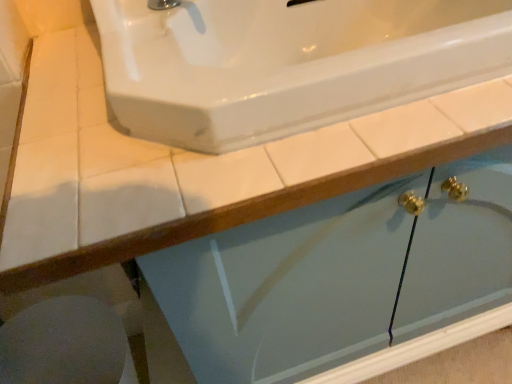
The image size is (512, 384). What do you see at coordinates (288, 63) in the screenshot?
I see `white glossy sink at upper center` at bounding box center [288, 63].

The image size is (512, 384). Find the location of `white glossy sink at upper center`. white glossy sink at upper center is located at coordinates coord(288,63).

The image size is (512, 384). In order to click on white glossy porcelain at lower left in this screenshot , I will do `click(66, 344)`.

What do you see at coordinates (66, 344) in the screenshot?
I see `white glossy porcelain at lower left` at bounding box center [66, 344].

At what (x,y) coordinates should I click in order to perform the action: click on white glossy sink at upper center. Please return your answer as a coordinate pair (x, y). Looking at the image, I should click on (288, 63).

Considering the positions of objects white glossy porcelain at lower left and white glossy sink at upper center in the image provided, who is more to the left, white glossy porcelain at lower left or white glossy sink at upper center?

white glossy porcelain at lower left is more to the left.

Is white glossy porcelain at lower left further to camera compared to white glossy sink at upper center?

Yes, white glossy porcelain at lower left is behind white glossy sink at upper center.

Does point (48, 374) come behind point (432, 63)?

Yes, it is.

From the image's perspective, which object appears higher, white glossy porcelain at lower left or white glossy sink at upper center?

white glossy sink at upper center, from the image's perspective.

From a real-world perspective, is white glossy porcelain at lower left positioned over white glossy sink at upper center based on gravity?

No.

Looking at their sizes, would you say white glossy porcelain at lower left is wider or thinner than white glossy sink at upper center?

In the image, white glossy porcelain at lower left appears to be more narrow than white glossy sink at upper center.

Considering the relative sizes of white glossy porcelain at lower left and white glossy sink at upper center in the image provided, is white glossy porcelain at lower left taller than white glossy sink at upper center?

Yes, white glossy porcelain at lower left is taller than white glossy sink at upper center.

Who is smaller, white glossy porcelain at lower left or white glossy sink at upper center?

With smaller size is white glossy porcelain at lower left.

Would you say white glossy porcelain at lower left is outside white glossy sink at upper center?

Indeed, white glossy porcelain at lower left is completely outside white glossy sink at upper center.

Is white glossy porcelain at lower left next to white glossy sink at upper center and touching it?

No.

Could you tell me if white glossy porcelain at lower left is facing white glossy sink at upper center?

No, white glossy porcelain at lower left does not turn towards white glossy sink at upper center.

The image size is (512, 384). I want to click on sink above the white glossy porcelain at lower left (from the image's perspective), so click(288, 63).

Would you say white glossy sink at upper center is to the left or to the right of white glossy porcelain at lower left in the picture?

Based on their positions, white glossy sink at upper center is located to the right of white glossy porcelain at lower left.

Is the position of white glossy sink at upper center less distant than that of white glossy porcelain at lower left?

Yes, it is.

Which point is more forward, (190,12) or (7,331)?

Positioned in front is point (190,12).

From the image's perspective, between white glossy sink at upper center and white glossy porcelain at lower left, who is located below?

white glossy porcelain at lower left is shown below in the image.

From a real-world perspective, is white glossy sink at upper center on top of white glossy porcelain at lower left?

Yes.

In terms of width, does white glossy sink at upper center look wider or thinner when compared to white glossy porcelain at lower left?

Considering their sizes, white glossy sink at upper center looks broader than white glossy porcelain at lower left.

Based on the photo, is white glossy sink at upper center shorter than white glossy porcelain at lower left?

Correct, white glossy sink at upper center is not as tall as white glossy porcelain at lower left.

Is white glossy sink at upper center bigger or smaller than white glossy porcelain at lower left?

white glossy sink at upper center is bigger than white glossy porcelain at lower left.

From the picture: Is white glossy porcelain at lower left located within white glossy sink at upper center?

No, white glossy porcelain at lower left is not surrounded by white glossy sink at upper center.

Is white glossy sink at upper center next to white glossy porcelain at lower left?

No, white glossy sink at upper center is not with white glossy porcelain at lower left.

Could you tell me if white glossy sink at upper center is turned towards white glossy porcelain at lower left?

No, white glossy sink at upper center is not oriented towards white glossy porcelain at lower left.

Measure the distance from white glossy sink at upper center to white glossy porcelain at lower left.

24.96 inches.

Find the location of a particular element. sink above the white glossy porcelain at lower left (from the image's perspective) is located at coordinates (288, 63).

Where is `porcelain on the left of white glossy sink at upper center`? porcelain on the left of white glossy sink at upper center is located at coordinates (66, 344).

Locate an element on the screen. porcelain below the white glossy sink at upper center (from a real-world perspective) is located at coordinates (66, 344).